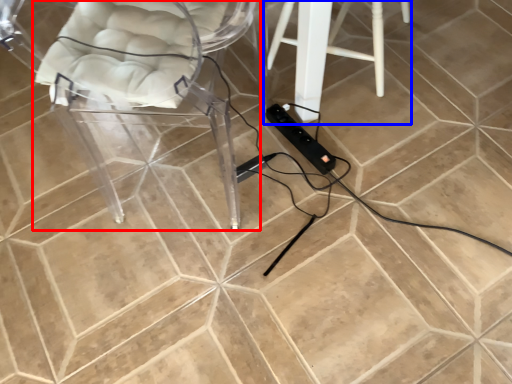
Question: Which object appears closest to the camera in this image, chair (highlighted by a red box) or furniture (highlighted by a blue box)?

Choices:
 (A) chair
 (B) furniture

Answer: (A)